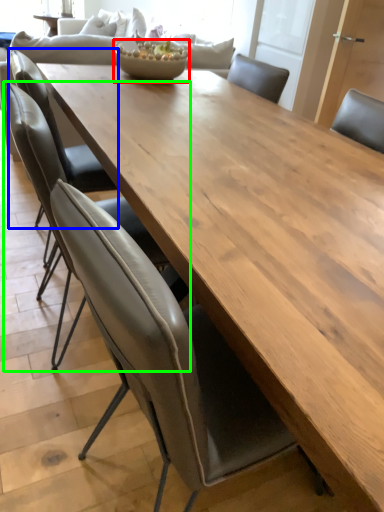
Question: Which object is positioned farthest from salad bowl (highlighted by a red box)? Select from chair (highlighted by a blue box) and chair (highlighted by a green box).

Choices:
 (A) chair
 (B) chair

Answer: (B)